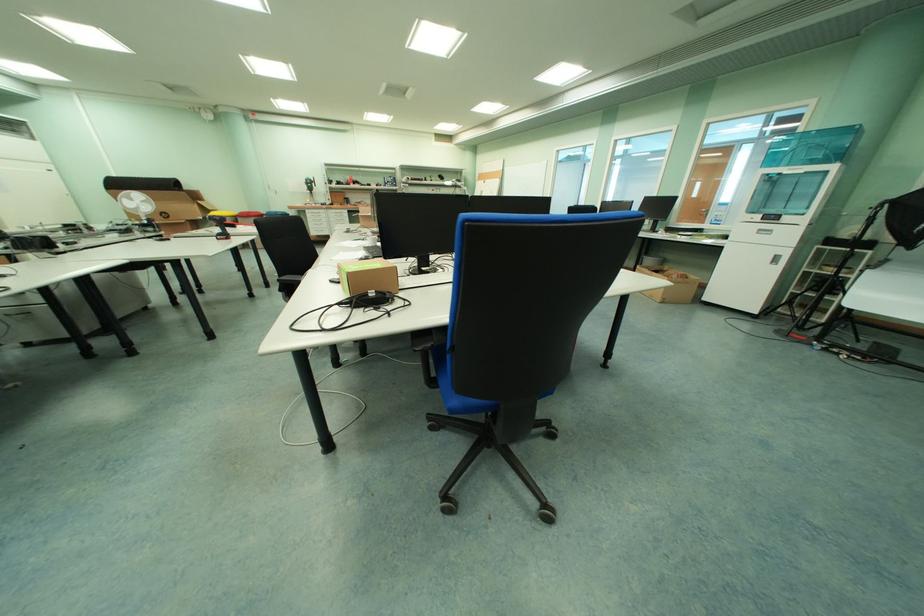
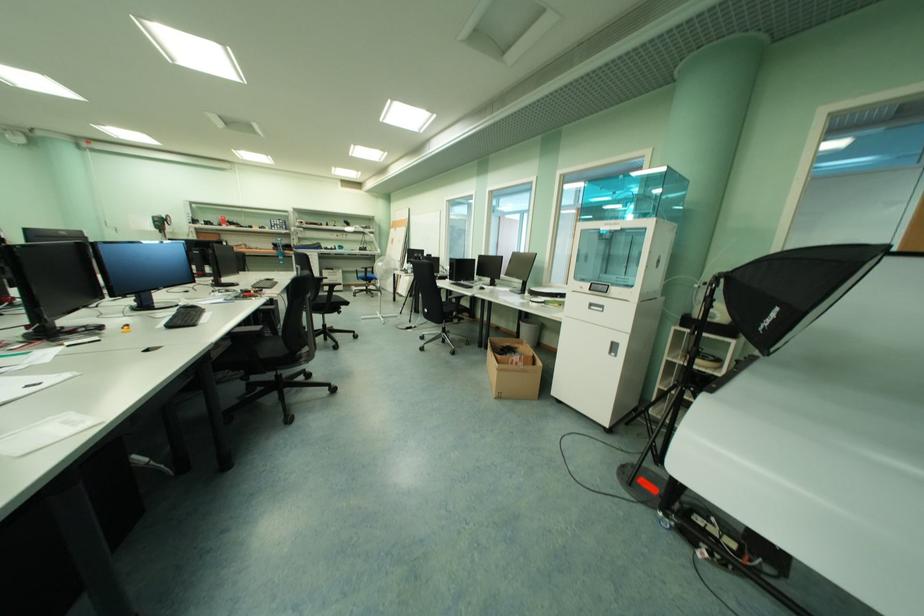
Which direction would the cameraman need to move to produce the second image?

The cameraman moved toward right, forward.